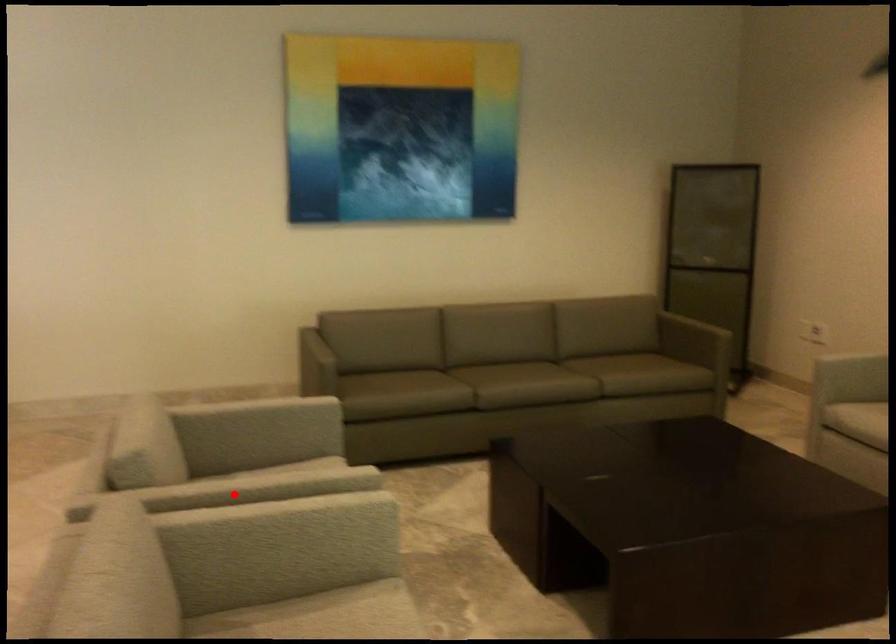
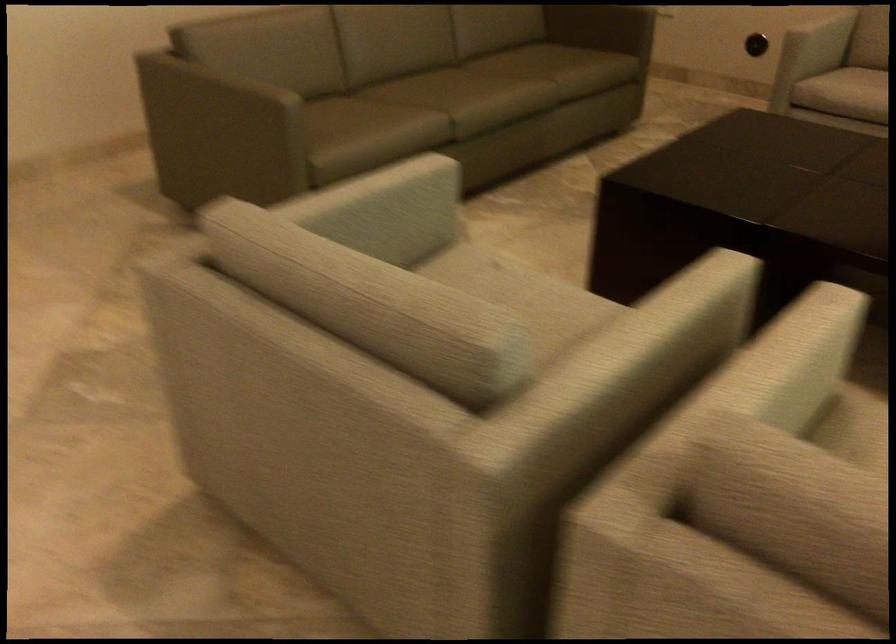
Locate, in the second image, the point that corresponds to the highlighted location in the first image.

(659, 332)